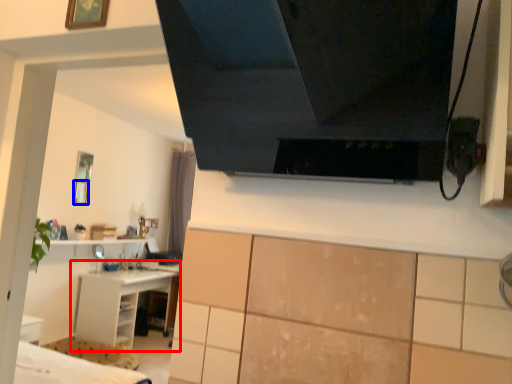
Question: Which of the following is the closest to the observer, shelf (highlighted by a red box) or picture frame (highlighted by a blue box)?

Choices:
 (A) shelf
 (B) picture frame

Answer: (A)